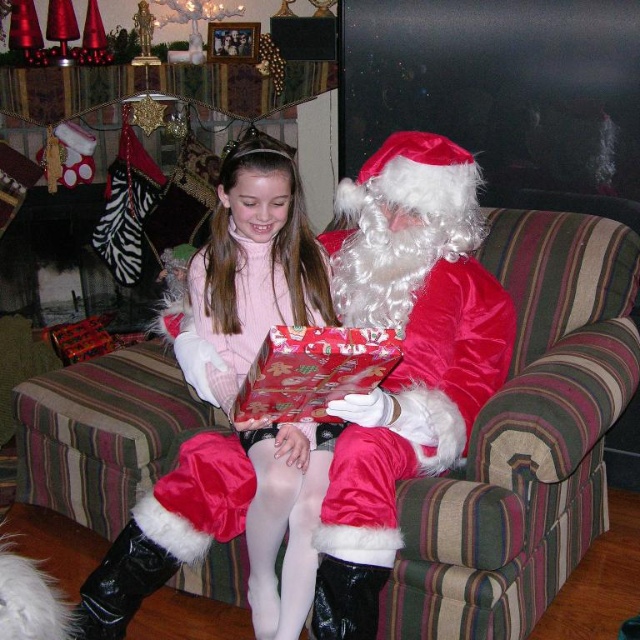
Who is positioned more to the right, satin santa at center or matte pink sweater at center?

From the viewer's perspective, satin santa at center appears more on the right side.

Between satin santa at center and matte pink sweater at center, which one is positioned lower?

Positioned lower is satin santa at center.

Which is in front, point (378, 294) or point (268, 262)?

Point (378, 294) is more forward.

What are the coordinates of `satin santa at center` in the screenshot? It's located at (404, 356).

Is point (432, 378) farther from camera compared to point (282, 353)?

Yes, point (432, 378) is behind point (282, 353).

Does satin santa at center appear over shiny red wrapping paper at center?

No.

In order to click on satin santa at center in this screenshot , I will do (404, 356).

Is striped fabric couch at center positioned at the back of shiny red wrapping paper at center?

Yes, striped fabric couch at center is behind shiny red wrapping paper at center.

Image resolution: width=640 pixels, height=640 pixels. Identify the location of striped fabric couch at center. (x=525, y=438).

I want to click on striped fabric couch at center, so click(525, 438).